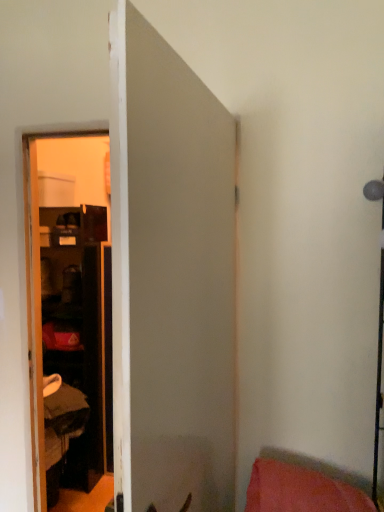
This screenshot has height=512, width=384. In order to click on pink fabric pillow at lower right in this screenshot , I will do `click(300, 490)`.

The height and width of the screenshot is (512, 384). What do you see at coordinates (300, 490) in the screenshot? I see `pink fabric pillow at lower right` at bounding box center [300, 490].

Where is `white matte door at center`? The height and width of the screenshot is (512, 384). white matte door at center is located at coordinates (170, 277).

This screenshot has width=384, height=512. What do you see at coordinates (170, 277) in the screenshot?
I see `white matte door at center` at bounding box center [170, 277].

Measure the distance between point (132, 61) and camera.

The depth of point (132, 61) is 27.36 inches.

Image resolution: width=384 pixels, height=512 pixels. I want to click on pink fabric pillow at lower right, so pos(300,490).

In the scene shown: Does white matte door at center appear on the right side of pink fabric pillow at lower right?

In fact, white matte door at center is to the left of pink fabric pillow at lower right.

Between white matte door at center and pink fabric pillow at lower right, which one is positioned behind?

pink fabric pillow at lower right.

Which is behind, point (125, 7) or point (282, 481)?

The point (282, 481) is farther.

From the image's perspective, between white matte door at center and pink fabric pillow at lower right, who is located below?

From the image's view, pink fabric pillow at lower right is below.

From a real-world perspective, is white matte door at center positioned above or below pink fabric pillow at lower right?

Clearly, from a real-world perspective, white matte door at center is above pink fabric pillow at lower right.

Between white matte door at center and pink fabric pillow at lower right, which one has larger width?

Wider between the two is pink fabric pillow at lower right.

Can you confirm if white matte door at center is taller than pink fabric pillow at lower right?

Indeed, white matte door at center has a greater height compared to pink fabric pillow at lower right.

Considering the relative sizes of white matte door at center and pink fabric pillow at lower right in the image provided, is white matte door at center smaller than pink fabric pillow at lower right?

No, white matte door at center is not smaller than pink fabric pillow at lower right.

Which is correct: white matte door at center is inside pink fabric pillow at lower right, or outside of it?

white matte door at center is spatially situated outside pink fabric pillow at lower right.

Are white matte door at center and pink fabric pillow at lower right located far from each other?

white matte door at center is near pink fabric pillow at lower right, not far away.

Is white matte door at center facing away from pink fabric pillow at lower right?

Yes, white matte door at center is positioned with its back facing pink fabric pillow at lower right.

From the picture: How different are the orientations of white matte door at center and pink fabric pillow at lower right in degrees?

There is a 85.7-degree angle between the facing directions of white matte door at center and pink fabric pillow at lower right.

How distant is white matte door at center from pink fabric pillow at lower right?

white matte door at center is 22.10 inches from pink fabric pillow at lower right.

Where is `pillow that is below the white matte door at center (from the image's perspective)`? Image resolution: width=384 pixels, height=512 pixels. pillow that is below the white matte door at center (from the image's perspective) is located at coordinates (300, 490).

Considering the positions of objects pink fabric pillow at lower right and white matte door at center in the image provided, who is more to the left, pink fabric pillow at lower right or white matte door at center?

Positioned to the left is white matte door at center.

Who is more distant, pink fabric pillow at lower right or white matte door at center?

Positioned behind is pink fabric pillow at lower right.

Is point (336, 498) positioned after point (156, 231)?

Yes.

From the image's perspective, which is below, pink fabric pillow at lower right or white matte door at center?

pink fabric pillow at lower right appears lower in the image.

From a real-world perspective, is pink fabric pillow at lower right above or below white matte door at center?

From a real-world perspective, pink fabric pillow at lower right is physically below white matte door at center.

Considering the sizes of objects pink fabric pillow at lower right and white matte door at center in the image provided, who is wider, pink fabric pillow at lower right or white matte door at center?

pink fabric pillow at lower right.

In terms of height, does pink fabric pillow at lower right look taller or shorter compared to white matte door at center?

pink fabric pillow at lower right is shorter than white matte door at center.

Is pink fabric pillow at lower right bigger than white matte door at center?

No, pink fabric pillow at lower right is not bigger than white matte door at center.

In the scene shown: Is pink fabric pillow at lower right located outside white matte door at center?

Yes, pink fabric pillow at lower right is located beyond the bounds of white matte door at center.

Are pink fabric pillow at lower right and white matte door at center located far from each other?

No, there isn't a large distance between pink fabric pillow at lower right and white matte door at center.

Could you tell me if pink fabric pillow at lower right is turned towards white matte door at center?

No, pink fabric pillow at lower right is not facing towards white matte door at center.

Measure the distance from pink fabric pillow at lower right to white matte door at center.

pink fabric pillow at lower right and white matte door at center are 22.10 inches apart from each other.

Find the location of a particular element. The image size is (384, 512). pillow to the right of white matte door at center is located at coordinates (300, 490).

Find the location of a particular element. door above the pink fabric pillow at lower right (from the image's perspective) is located at coordinates (170, 277).

At what (x,y) coordinates should I click in order to perform the action: click on pillow below the white matte door at center (from a real-world perspective). Please return your answer as a coordinate pair (x, y). The height and width of the screenshot is (512, 384). Looking at the image, I should click on (x=300, y=490).